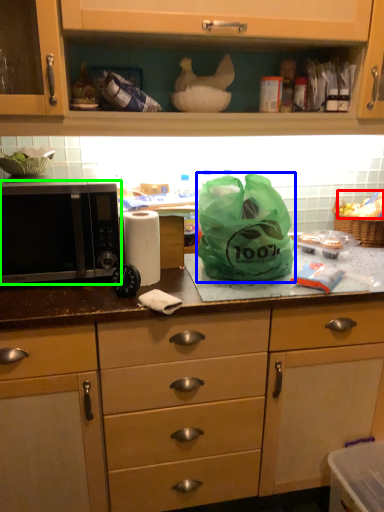
Question: Which is farther away from food (highlighted by a red box)? plastic bag (highlighted by a blue box) or microwave oven (highlighted by a green box)?

Choices:
 (A) plastic bag
 (B) microwave oven

Answer: (B)